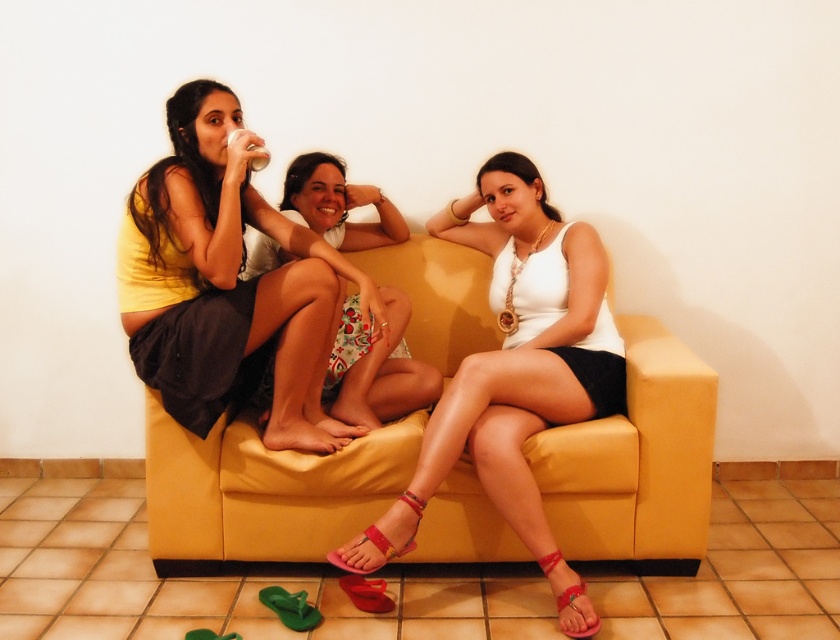
Question: Based on their relative distances, which object is farther from the shiny pink sandal at lower center?

Choices:
 (A) matte pink sandal at lower right
 (B) floral fabric skirt at center
 (C) matte red sandal at lower center

Answer: (A)

Question: Which point is closer to the camera taking this photo?

Choices:
 (A) (260, 168)
 (B) (441, 218)
 (C) (143, 275)

Answer: (A)

Question: Is white matte tank top at center to the right of shiny pink sandal at lower center from the viewer's perspective?

Choices:
 (A) no
 (B) yes

Answer: (B)

Question: Does white matte tank top at center have a larger size compared to matte plastic cup at upper center?

Choices:
 (A) yes
 (B) no

Answer: (A)

Question: Considering the real-world distances, which object is farthest from the matte yellow dress at upper left?

Choices:
 (A) yellow fabric couch at center
 (B) matte red sandal at lower center
 (C) white matte tank top at center
 (D) shiny pink sandal at lower center

Answer: (B)

Question: Is the position of white matte tank top at center more distant than that of matte plastic cup at upper center?

Choices:
 (A) no
 (B) yes

Answer: (A)